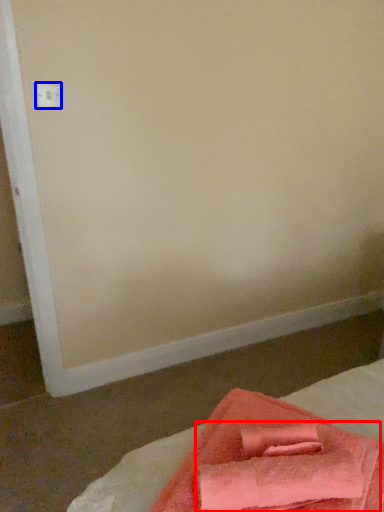
Question: Which object is closer to the camera taking this photo, bath towel (highlighted by a red box) or electric outlet (highlighted by a blue box)?

Choices:
 (A) bath towel
 (B) electric outlet

Answer: (A)